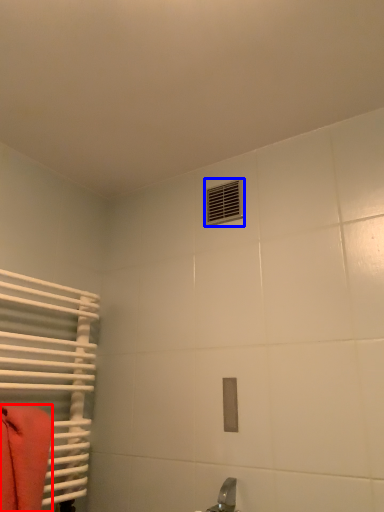
Question: Which of the following is the closest to the observer, towel (highlighted by a red box) or air conditioning (highlighted by a blue box)?

Choices:
 (A) towel
 (B) air conditioning

Answer: (A)